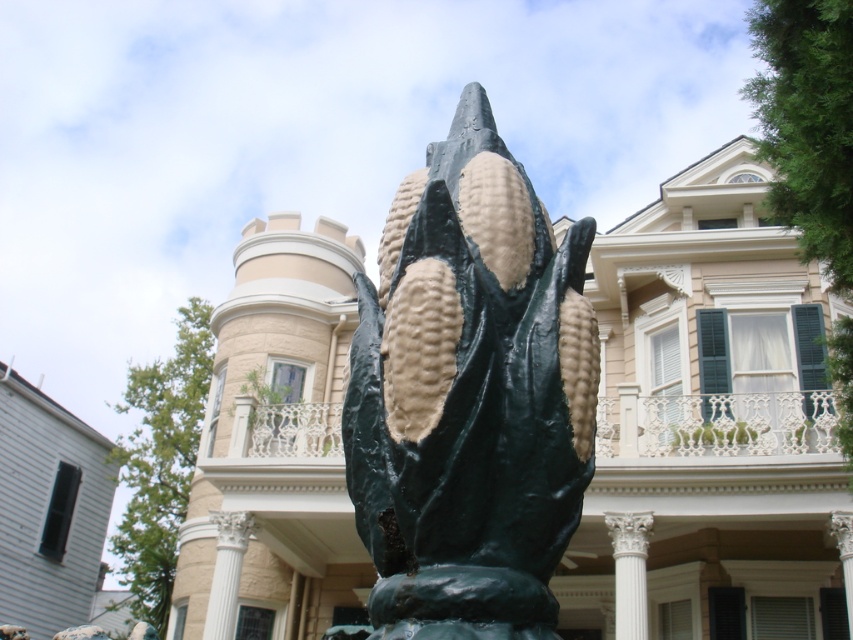
Question: Which object appears closest to the camera in this image?

Choices:
 (A) white marble column at center
 (B) white glossy column at center

Answer: (A)

Question: From the image, what is the correct spatial relationship of green matte corn at center in relation to white glossy column at center?

Choices:
 (A) below
 (B) above

Answer: (B)

Question: Is green matte corn at center positioned in front of white marble column at center?

Choices:
 (A) no
 (B) yes

Answer: (B)

Question: Can you confirm if green matte corn at center is positioned to the left of white marble column at center?

Choices:
 (A) yes
 (B) no

Answer: (A)

Question: Which of these objects is positioned farthest from the white marble column at center?

Choices:
 (A) white glossy column at center
 (B) green matte corn at center

Answer: (B)

Question: Which object appears closest to the camera in this image?

Choices:
 (A) white marble column at center
 (B) white glossy column at center

Answer: (A)